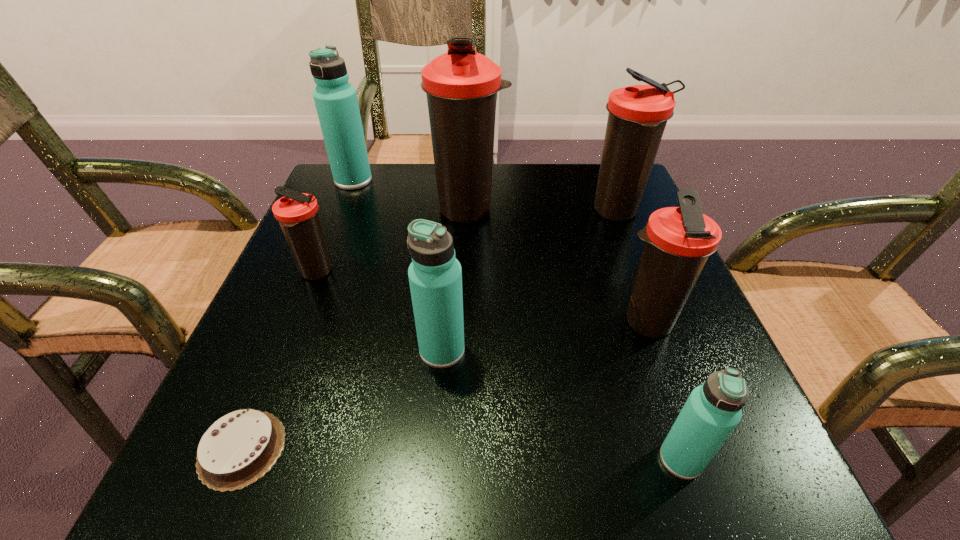
Image resolution: width=960 pixels, height=540 pixels. What are the coordinates of `aqua thermos bottle that is the second closest to the biggest brown thermos bottle` in the screenshot? It's located at (435, 276).

Image resolution: width=960 pixels, height=540 pixels. I want to click on the second closest aqua thermos bottle to the leftmost brown thermos bottle, so click(336, 102).

Identify the location of vacant space that satisfies the following two spatial constraints: 1. on the front side of the nearest thermos bottle; 2. on the left side of the second smallest aqua thermos bottle. (434, 459).

The width and height of the screenshot is (960, 540). I want to click on free space that satisfies the following two spatial constraints: 1. on the back side of the nearest brown thermos bottle; 2. on the right side of the second biggest brown thermos bottle, so click(606, 212).